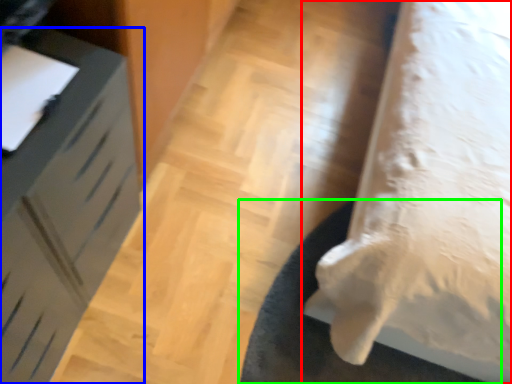
Question: Which object is positioned farthest from furniture (highlighted by a red box)? Select from furniture (highlighted by a blue box) and mat (highlighted by a green box).

Choices:
 (A) furniture
 (B) mat

Answer: (A)